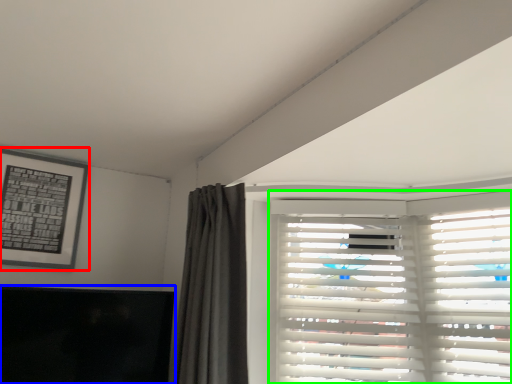
Question: Which object is positioned closest to picture frame (highlighted by a red box)? Select from window screen (highlighted by a blue box) and window blind (highlighted by a green box).

Choices:
 (A) window screen
 (B) window blind

Answer: (A)